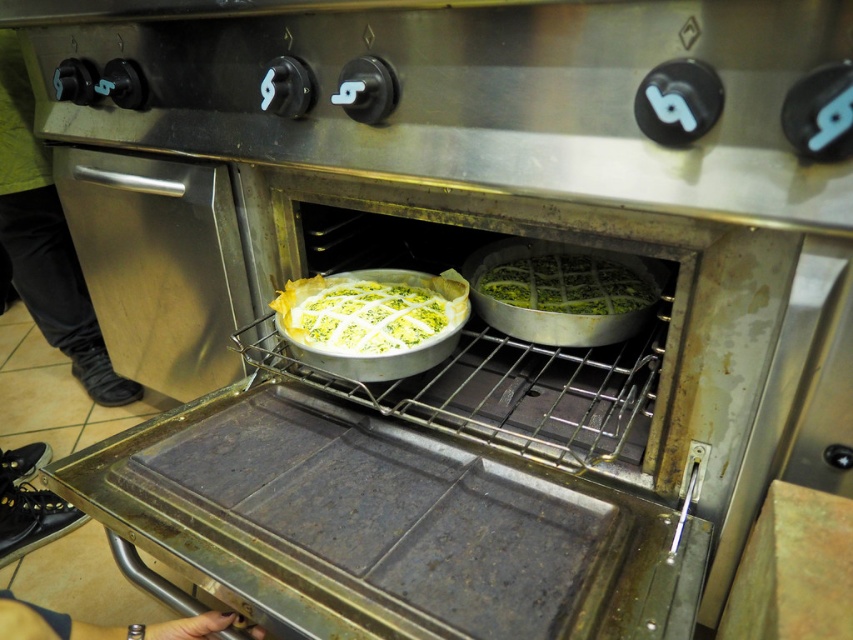
Which is above, white paper pie crust at center or green matte pie at center?

green matte pie at center is above.

Is white paper pie crust at center taller than green matte pie at center?

Yes.

At what (x,y) coordinates should I click in order to perform the action: click on white paper pie crust at center. Please return your answer as a coordinate pair (x, y). Looking at the image, I should click on (370, 310).

Does green fabric pants at lower left appear on the right side of black leather shoe at lower left?

No, green fabric pants at lower left is not to the right of black leather shoe at lower left.

Does green fabric pants at lower left have a lesser height compared to black leather shoe at lower left?

In fact, green fabric pants at lower left may be taller than black leather shoe at lower left.

Does point (61, 289) come farther from viewer compared to point (250, 632)?

Yes, point (61, 289) is farther from viewer.

Where is `green fabric pants at lower left`? Image resolution: width=853 pixels, height=640 pixels. green fabric pants at lower left is located at coordinates (45, 241).

Is green matte pie at center above black leather shoe at lower left?

Indeed, green matte pie at center is positioned over black leather shoe at lower left.

Who is more forward, [485,289] or [9,625]?

Point [9,625] is more forward.

Locate an element on the screen. green matte pie at center is located at coordinates (567, 284).